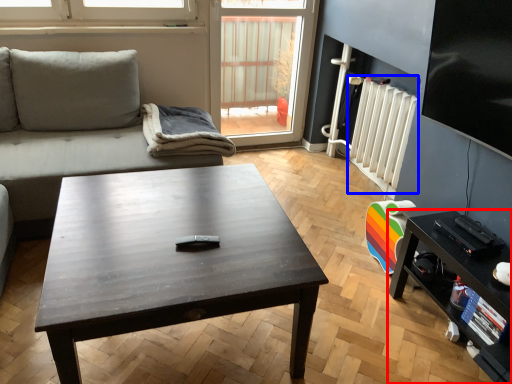
Question: Which object appears farthest to the camera in this image, table (highlighted by a red box) or radiator (highlighted by a blue box)?

Choices:
 (A) table
 (B) radiator

Answer: (B)